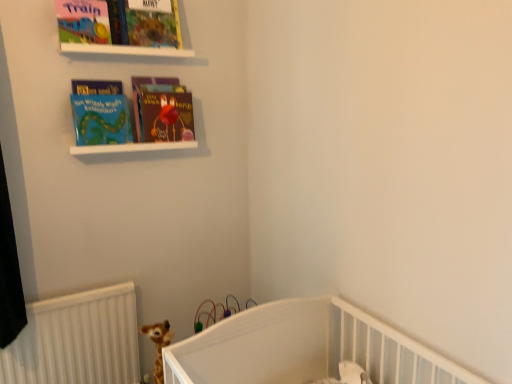
Where is `vacant space in matte hardcover book at center, acting as the first book starting from the right (from a real-world perspective)`? vacant space in matte hardcover book at center, acting as the first book starting from the right (from a real-world perspective) is located at coordinates (165, 136).